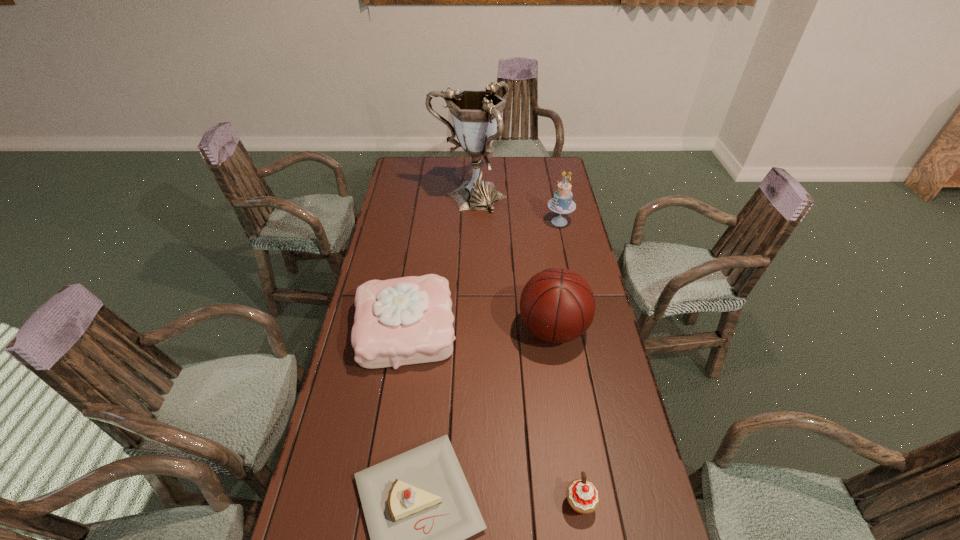
This screenshot has width=960, height=540. In the image, there is a desktop. What are the coordinates of `free region at the left edge` in the screenshot? It's located at (327, 457).

In the image, there is a desktop. What are the coordinates of `vacant area at the right edge` in the screenshot? It's located at (569, 221).

The height and width of the screenshot is (540, 960). In order to click on free point at the far left corner in this screenshot , I will do `click(404, 171)`.

Locate an element on the screen. This screenshot has width=960, height=540. vacant space in between the tallest object and the third shortest object is located at coordinates (438, 263).

Where is `vacant space in between the fourth tallest object and the basketball`? The image size is (960, 540). vacant space in between the fourth tallest object and the basketball is located at coordinates (479, 329).

This screenshot has height=540, width=960. In order to click on vacant region between the cupcake and the basketball in this screenshot , I will do `click(566, 416)`.

Where is `free spot between the trophy cup and the second tallest cake`? The image size is (960, 540). free spot between the trophy cup and the second tallest cake is located at coordinates [x=438, y=263].

Locate an element on the screen. The height and width of the screenshot is (540, 960). free area in between the trophy cup and the farthest cake is located at coordinates (515, 210).

Image resolution: width=960 pixels, height=540 pixels. I want to click on empty space that is in between the tallest object and the cupcake, so click(x=524, y=350).

Locate an element on the screen. The height and width of the screenshot is (540, 960). object that is the third closest to the basketball is located at coordinates (582, 495).